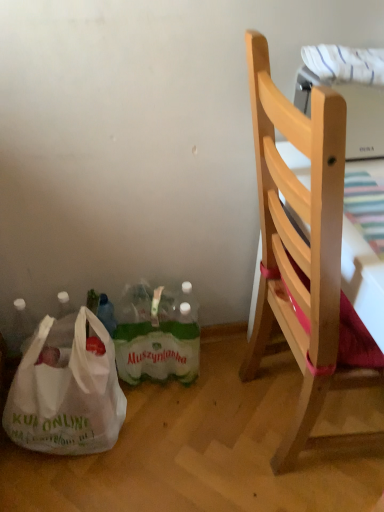
This screenshot has height=512, width=384. Identify the location of free space between green plastic bottles at lower center and white plastic bag at lower left. (152, 415).